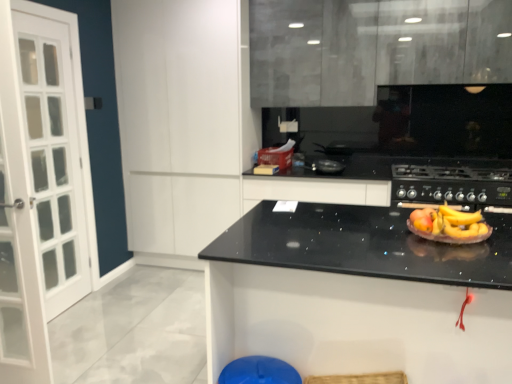
Question: Is blue plastic bar stool at lower center at the back of black granite countertop at center?

Choices:
 (A) no
 (B) yes

Answer: (A)

Question: Would you say blue plastic bar stool at lower center is part of black granite countertop at center's contents?

Choices:
 (A) yes
 (B) no

Answer: (A)

Question: Is black granite countertop at center bigger than blue plastic bar stool at lower center?

Choices:
 (A) yes
 (B) no

Answer: (A)

Question: Does black granite countertop at center have a greater width compared to blue plastic bar stool at lower center?

Choices:
 (A) yes
 (B) no

Answer: (A)

Question: Is the depth of black granite countertop at center greater than that of blue plastic bar stool at lower center?

Choices:
 (A) no
 (B) yes

Answer: (A)

Question: From the image's perspective, is black granite countertop at center above or below white matte cabinet at upper left, which is the first cabinetry in left-to-right order?

Choices:
 (A) below
 (B) above

Answer: (A)

Question: Is point (382, 307) closer or farther from the camera than point (164, 251)?

Choices:
 (A) farther
 (B) closer

Answer: (B)

Question: From a real-world perspective, is black granite countertop at center physically located above or below white matte cabinet at upper left, which is the first cabinetry in left-to-right order?

Choices:
 (A) above
 (B) below

Answer: (B)

Question: Considering their positions, is black granite countertop at center located in front of or behind white matte cabinet at upper left, which is the first cabinetry in left-to-right order?

Choices:
 (A) front
 (B) behind

Answer: (A)

Question: Is point (268, 372) closer or farther from the camera than point (245, 200)?

Choices:
 (A) closer
 (B) farther

Answer: (A)

Question: Looking at their shapes, would you say blue plastic bar stool at lower center is wider or thinner than white matte cabinet at upper left, which is the first cabinetry in left-to-right order?

Choices:
 (A) wide
 (B) thin

Answer: (B)

Question: Is blue plastic bar stool at lower center inside or outside of white matte cabinet at upper left, which is the first cabinetry in left-to-right order?

Choices:
 (A) outside
 (B) inside

Answer: (A)

Question: Is blue plastic bar stool at lower center bigger or smaller than white matte cabinet at upper left, which is counted as the second cabinetry, starting from the right?

Choices:
 (A) small
 (B) big

Answer: (A)

Question: From the image's perspective, relative to matte black paper plate at center, is black matte gas stove at center above or below?

Choices:
 (A) above
 (B) below

Answer: (A)

Question: From a real-world perspective, is black matte gas stove at center physically located above or below matte black paper plate at center?

Choices:
 (A) above
 (B) below

Answer: (B)